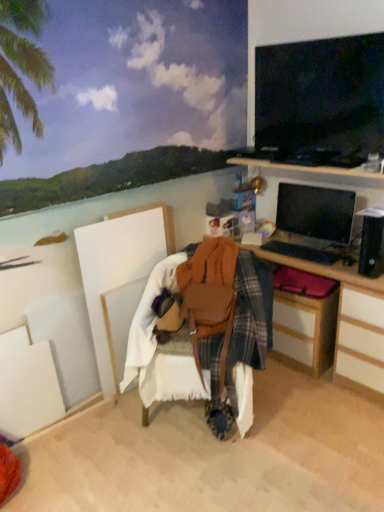
Find the location of a particular element. The width and height of the screenshot is (384, 512). free spot to the left of leather at center is located at coordinates coord(96,444).